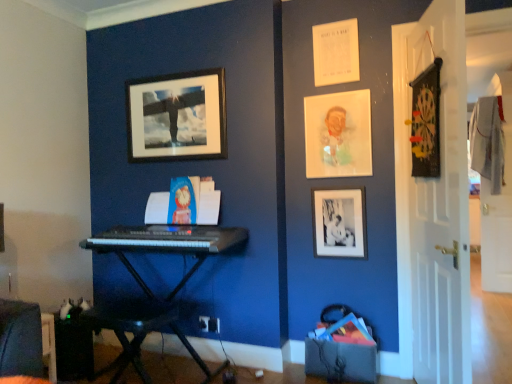
Locate an element on the screen. black matte picture frame at upper center, the 3th picture frame from the right is located at coordinates (177, 116).

At what (x,y) coordinates should I click in order to perform the action: click on black matte picture frame at lower right, marked as the 3th picture frame in a left-to-right arrangement. Please return your answer as a coordinate pair (x, y). Looking at the image, I should click on (339, 223).

The image size is (512, 384). I want to click on white wooden door at right, placed as the first door when sorted from left to right, so click(441, 209).

Measure the distance between point (342, 148) and camera.

Point (342, 148) is 8.49 feet away from camera.

This screenshot has width=512, height=384. Identify the location of black plastic keyboard at center. (149, 288).

At what (x,y) coordinates should I click in order to perform the action: click on black plastic keyboard at center. Please return your answer as a coordinate pair (x, y). Looking at the image, I should click on (167, 239).

Which of these two, black plastic keyboard at center or black plastic keyboard at lower left, stands taller?

With more height is black plastic keyboard at center.

The width and height of the screenshot is (512, 384). Find the location of `table on the left of black plastic keyboard at center`. table on the left of black plastic keyboard at center is located at coordinates (138, 331).

Could you tell me if black plastic keyboard at center is facing black plastic keyboard at lower left?

Yes, black plastic keyboard at center is oriented towards black plastic keyboard at lower left.

From the image's perspective, between black plastic keyboard at center and black plastic keyboard at lower left, who is located below?

black plastic keyboard at lower left is shown below in the image.

How far apart are velvet dark blue swivel chair at lower left and black plastic keyboard at lower left?

velvet dark blue swivel chair at lower left and black plastic keyboard at lower left are 1.13 meters apart.

Between point (31, 331) and point (123, 319), which one is positioned in front?

The point (31, 331) is in front.

Considering the relative sizes of velvet dark blue swivel chair at lower left and black plastic keyboard at lower left in the image provided, is velvet dark blue swivel chair at lower left wider than black plastic keyboard at lower left?

Correct, the width of velvet dark blue swivel chair at lower left exceeds that of black plastic keyboard at lower left.

What's the angular difference between velvet dark blue swivel chair at lower left and black plastic keyboard at lower left's facing directions?

velvet dark blue swivel chair at lower left and black plastic keyboard at lower left are facing 90.7 degrees away from each other.

Is white wooden door at right, positioned as the 2th door in back-to-front order, next to black plastic keyboard at center?

There is a gap between white wooden door at right, positioned as the 2th door in back-to-front order, and black plastic keyboard at center.

How much distance is there between white wooden door at right, placed as the first door when sorted from left to right, and black plastic keyboard at center?

white wooden door at right, placed as the first door when sorted from left to right, is 4.25 feet from black plastic keyboard at center.

Could you tell me if white wooden door at right, positioned as the first door in front-to-back order, is turned towards black plastic keyboard at center?

Yes.

Which object is positioned more to the right, black plastic keyboard at center or white wood door at right, which is the second door from left to right?

From the viewer's perspective, white wood door at right, which is the second door from left to right, appears more on the right side.

Does black plastic keyboard at center have a larger size compared to white wood door at right, which appears as the 1th door when viewed from the right?

Yes.

Considering the positions of objects black plastic keyboard at center and white wood door at right, which appears as the 1th door when viewed from the right, in the image provided, who is in front, black plastic keyboard at center or white wood door at right, which appears as the 1th door when viewed from the right,?

black plastic keyboard at center.

Between black plastic keyboard at center and white wood door at right, which is the 1th door from back to front, which one has more height?

white wood door at right, which is the 1th door from back to front, is taller.

From the image's perspective, is black plastic keyboard at center above or below white wooden door at right, positioned as the 2th door in back-to-front order?

From the image's perspective, black plastic keyboard at center appears below white wooden door at right, positioned as the 2th door in back-to-front order.

Where is `piano behind the white wooden door at right, positioned as the 2th door in back-to-front order`? The width and height of the screenshot is (512, 384). piano behind the white wooden door at right, positioned as the 2th door in back-to-front order is located at coordinates (149, 288).

Who is smaller, black plastic keyboard at center or white wooden door at right, positioned as the 2th door in back-to-front order?

Smaller between the two is white wooden door at right, positioned as the 2th door in back-to-front order.

From the image's perspective, is white wooden door at right, positioned as the first door in front-to-back order, above or below black matte picture frame at lower right, which is the 1th picture frame from right to left?

white wooden door at right, positioned as the first door in front-to-back order, is above black matte picture frame at lower right, which is the 1th picture frame from right to left.

Does point (462, 82) come farther from viewer compared to point (344, 195)?

No, (462, 82) is in front of (344, 195).

In terms of width, does white wooden door at right, positioned as the first door in front-to-back order, look wider or thinner when compared to black matte picture frame at lower right, marked as the 3th picture frame in a left-to-right arrangement?

white wooden door at right, positioned as the first door in front-to-back order, is wider than black matte picture frame at lower right, marked as the 3th picture frame in a left-to-right arrangement.

From a real-world perspective, who is located higher, white wooden door at right, the second door from the right, or black matte picture frame at lower right, marked as the 3th picture frame in a left-to-right arrangement?

In real-world perspective, white wooden door at right, the second door from the right, is above.

Considering the sizes of objects black matte picture frame at lower right, which is the 1th picture frame from right to left, and black plastic keyboard at center in the image provided, who is shorter, black matte picture frame at lower right, which is the 1th picture frame from right to left, or black plastic keyboard at center?

black plastic keyboard at center.

Is black matte picture frame at lower right, marked as the 3th picture frame in a left-to-right arrangement, positioned behind black plastic keyboard at center?

Yes, black matte picture frame at lower right, marked as the 3th picture frame in a left-to-right arrangement, is behind black plastic keyboard at center.

Is black matte picture frame at lower right, which is the 1th picture frame from right to left, facing away from black plastic keyboard at center?

No, black matte picture frame at lower right, which is the 1th picture frame from right to left, is not facing away from black plastic keyboard at center.

The image size is (512, 384). I want to click on table in front of the black plastic keyboard at center, so click(x=138, y=331).

This screenshot has width=512, height=384. In order to click on table located below the velvet dark blue swivel chair at lower left (from the image's perspective) in this screenshot , I will do `click(138, 331)`.

Based on their spatial positions, is velvet dark blue swivel chair at lower left or matte plastic portrait at upper right, the 2th picture frame in the left-to-right sequence, further from black plastic keyboard at center?

velvet dark blue swivel chair at lower left is further to black plastic keyboard at center.

Considering their positions, is white wood door at right, which is the 1th door from back to front, positioned further to white wooden door at right, the second door from the right, than velvet dark blue swivel chair at lower left?

The object further to white wooden door at right, the second door from the right, is white wood door at right, which is the 1th door from back to front.

From the image, which object appears to be farther from black matte picture frame at lower right, which is the 1th picture frame from right to left, black matte picture frame at upper center, the 3th picture frame from the right, or white wooden door at right, positioned as the first door in front-to-back order?

Based on the image, black matte picture frame at upper center, the 3th picture frame from the right, appears to be further to black matte picture frame at lower right, which is the 1th picture frame from right to left.

When comparing their distances from black plastic keyboard at center, does black matte picture frame at upper center, the 3th picture frame from the right, or white wooden door at right, the second door from the right, seem further?

white wooden door at right, the second door from the right, is further to black plastic keyboard at center.

When comparing their distances from black matte picture frame at upper center, arranged as the 1th picture frame when viewed from the left, does black plastic keyboard at center or white wooden door at right, placed as the first door when sorted from left to right, seem further?

white wooden door at right, placed as the first door when sorted from left to right.

Looking at the image, which one is located further to black matte picture frame at upper center, the 3th picture frame from the right, velvet dark blue swivel chair at lower left or white wood door at right, which is the 1th door from back to front?

white wood door at right, which is the 1th door from back to front, is further to black matte picture frame at upper center, the 3th picture frame from the right.

When comparing their distances from black plastic keyboard at lower left, does matte plastic portrait at upper right, marked as the 2th picture frame in a right-to-left arrangement, or black plastic keyboard at center seem closer?

The object closer to black plastic keyboard at lower left is black plastic keyboard at center.

Which object lies further to the anchor point black plastic keyboard at center, black plastic keyboard at lower left or black plastic keyboard at center?

black plastic keyboard at lower left lies further to black plastic keyboard at center than the other object.

Where is `picture frame between black matte picture frame at upper center, the 3th picture frame from the right, and black matte picture frame at lower right, marked as the 3th picture frame in a left-to-right arrangement`? This screenshot has width=512, height=384. picture frame between black matte picture frame at upper center, the 3th picture frame from the right, and black matte picture frame at lower right, marked as the 3th picture frame in a left-to-right arrangement is located at coordinates (338, 134).

The width and height of the screenshot is (512, 384). I want to click on piano located between velvet dark blue swivel chair at lower left and white wooden door at right, positioned as the first door in front-to-back order, in the left-right direction, so click(x=149, y=288).

The image size is (512, 384). I want to click on piano between black matte picture frame at upper center, arranged as the 1th picture frame when viewed from the left, and velvet dark blue swivel chair at lower left vertically, so click(x=149, y=288).

At what (x,y) coordinates should I click in order to perform the action: click on musical keyboard between velvet dark blue swivel chair at lower left and black plastic keyboard at center from left to right. Please return your answer as a coordinate pair (x, y). Looking at the image, I should click on (167, 239).